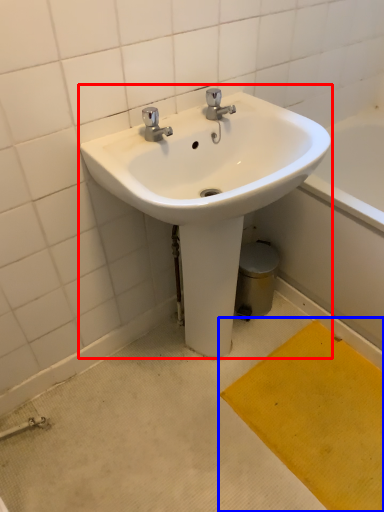
Question: Which object appears closest to the camera in this image, sink (highlighted by a red box) or doormat (highlighted by a blue box)?

Choices:
 (A) sink
 (B) doormat

Answer: (A)